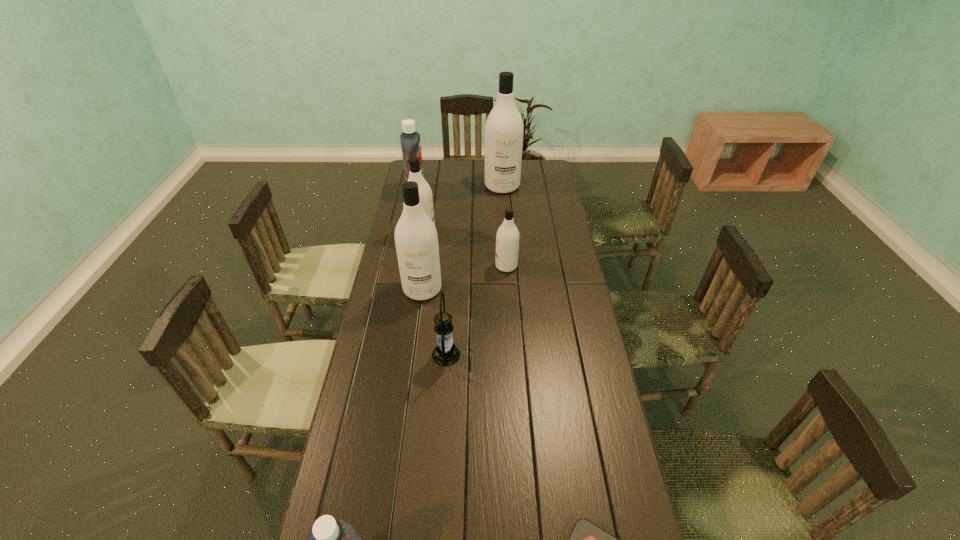
Locate an element on the screen. shampoo that is the third closest to the tallest shampoo is located at coordinates (507, 238).

Select which white shampoo is the fourth closest to the sixth farthest object. Please provide its 2D coordinates. Your answer should be formatted as a tuple, i.e. [(x, y)], where the tuple contains the x and y coordinates of a point satisfying the conditions above.

[(504, 127)]

Locate an element on the screen. Image resolution: width=960 pixels, height=540 pixels. white shampoo that is the third closest one to the smallest white shampoo is located at coordinates (504, 127).

Locate an element on the screen. This screenshot has width=960, height=540. free space that satisfies the following two spatial constraints: 1. on the front-facing side of the tallest shampoo; 2. on the front label of the farther blue shampoo is located at coordinates (503, 193).

The width and height of the screenshot is (960, 540). In order to click on vacant space that satisfies the following two spatial constraints: 1. on the front-facing side of the fifth nearest object; 2. on the front-facing side of the second tallest shampoo in this screenshot , I will do `click(508, 289)`.

Locate an element on the screen. This screenshot has height=540, width=960. free point that satisfies the following two spatial constraints: 1. on the front-facing side of the biggest white shampoo; 2. on the front-facing side of the second farthest white shampoo is located at coordinates (506, 234).